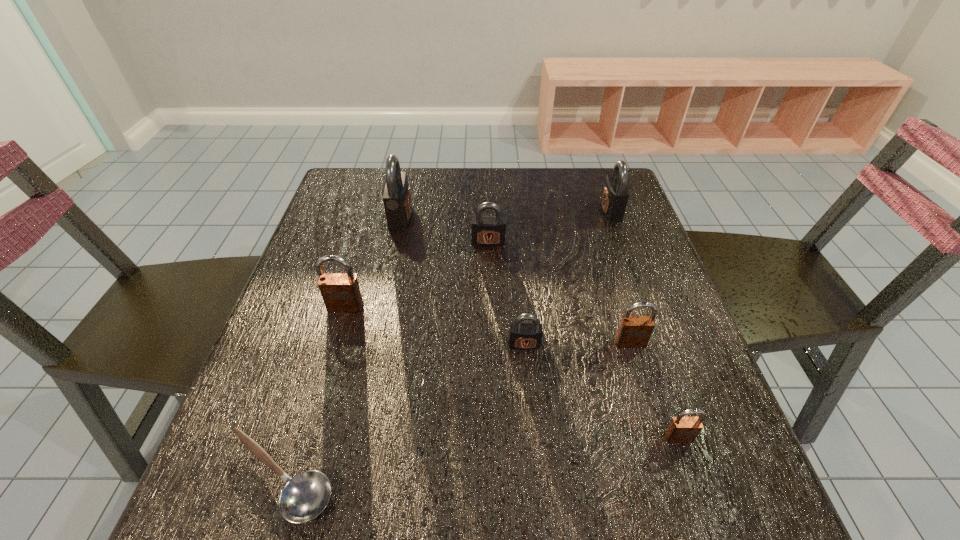
Find the location of `the sixth padlock from right to left`. the sixth padlock from right to left is located at coordinates (396, 195).

At what (x,y) coordinates should I click in order to perform the action: click on the biggest gray padlock. Please return your answer as a coordinate pair (x, y). Looking at the image, I should click on (396, 195).

Find the location of a particular element. the second biggest gray padlock is located at coordinates (615, 195).

Where is `the fifth nearest object`? The height and width of the screenshot is (540, 960). the fifth nearest object is located at coordinates (341, 293).

The height and width of the screenshot is (540, 960). In order to click on the fourth farthest padlock in this screenshot , I will do `click(341, 293)`.

Where is `the second nearest brown padlock`? This screenshot has height=540, width=960. the second nearest brown padlock is located at coordinates (634, 331).

Identify the location of the third farthest padlock. The width and height of the screenshot is (960, 540). (487, 231).

Locate an element on the screen. Image resolution: width=960 pixels, height=540 pixels. the sixth nearest object is located at coordinates (487, 231).

Where is `the smallest gray padlock`? The width and height of the screenshot is (960, 540). the smallest gray padlock is located at coordinates (522, 335).

In order to click on the smallest brown padlock in this screenshot , I will do `click(681, 429)`.